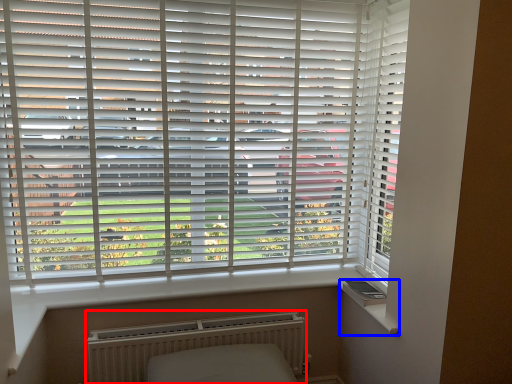
Question: Which point is closer to the camera, radiator (highlighted by a red box) or window sill (highlighted by a blue box)?

Choices:
 (A) radiator
 (B) window sill

Answer: (B)